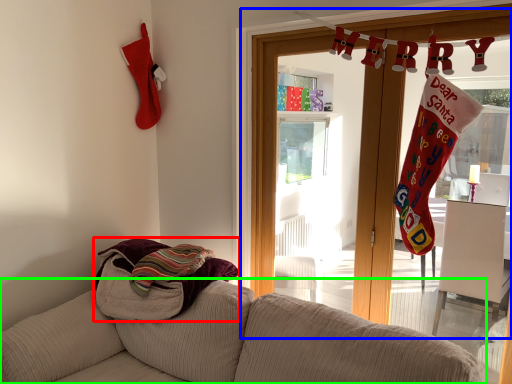
Question: Estimate the real-world distances between objects in this image. Which object is closer to beach towel (highlighted by a red box), window frame (highlighted by a blue box) or studio couch (highlighted by a green box)?

Choices:
 (A) window frame
 (B) studio couch

Answer: (B)